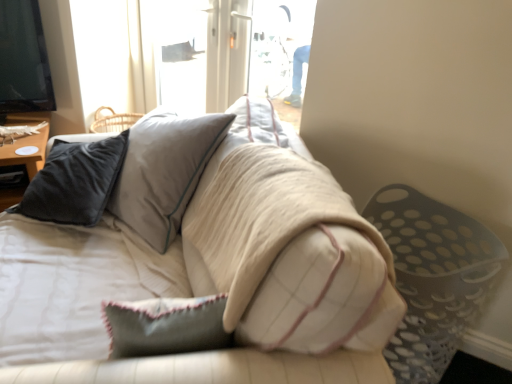
Measure the distance between point (21,115) and camera.

A distance of 2.24 meters exists between point (21,115) and camera.

Where is `matte black pillow at left`? The height and width of the screenshot is (384, 512). matte black pillow at left is located at coordinates (24, 155).

Describe the element at coordinates (24, 155) in the screenshot. Image resolution: width=512 pixels, height=384 pixels. I see `matte black pillow at left` at that location.

What do you see at coordinates (279, 326) in the screenshot? This screenshot has width=512, height=384. I see `soft beige fabric couch at center` at bounding box center [279, 326].

What is the approximate width of soft beige fabric couch at center?

soft beige fabric couch at center is 3.85 feet in width.

The height and width of the screenshot is (384, 512). Find the location of `soft beige fabric couch at center`. soft beige fabric couch at center is located at coordinates (279, 326).

At what (x,y) coordinates should I click in order to perform the action: click on matte black pillow at left. Please return your answer as a coordinate pair (x, y). Looking at the image, I should click on (24, 155).

Visually, is soft beige fabric couch at center positioned to the left or to the right of matte black pillow at left?

soft beige fabric couch at center is to the right of matte black pillow at left.

Which object is further away from the camera taking this photo, soft beige fabric couch at center or matte black pillow at left?

matte black pillow at left is further from the camera.

Which point is more forward, (34, 303) or (18, 143)?

Positioned in front is point (34, 303).

From the image's perspective, relative to matte black pillow at left, is soft beige fabric couch at center above or below?

soft beige fabric couch at center is below matte black pillow at left.

From a real-world perspective, is soft beige fabric couch at center positioned above or below matte black pillow at left?

soft beige fabric couch at center is above matte black pillow at left.

Considering the sizes of objects soft beige fabric couch at center and matte black pillow at left in the image provided, who is thinner, soft beige fabric couch at center or matte black pillow at left?

matte black pillow at left.

Does soft beige fabric couch at center have a lesser height compared to matte black pillow at left?

No.

Between soft beige fabric couch at center and matte black pillow at left, which one has smaller size?

matte black pillow at left.

Is matte black pillow at left a part of soft beige fabric couch at center?

No, matte black pillow at left is not surrounded by soft beige fabric couch at center.

Is soft beige fabric couch at center not close to matte black pillow at left?

soft beige fabric couch at center is actually quite close to matte black pillow at left.

Is soft beige fabric couch at center oriented towards matte black pillow at left?

Answer: No.

Can you tell me how much soft beige fabric couch at center and matte black pillow at left differ in facing direction?

The facing directions of soft beige fabric couch at center and matte black pillow at left are 95.6 degrees apart.

How much distance is there between soft beige fabric couch at center and matte black pillow at left?

A distance of 39.08 inches exists between soft beige fabric couch at center and matte black pillow at left.

Identify the location of table located underneath the soft beige fabric couch at center (from a real-world perspective). (24, 155).

Would you say matte black pillow at left is to the left or to the right of soft beige fabric couch at center in the picture?

matte black pillow at left is to the left of soft beige fabric couch at center.

Between matte black pillow at left and soft beige fabric couch at center, which one is positioned behind?

matte black pillow at left is further away from the camera.

Considering the positions of point (8, 125) and point (123, 375), is point (8, 125) closer or farther from the camera than point (123, 375)?

Clearly, point (8, 125) is more distant from the camera than point (123, 375).

From the image's perspective, relative to soft beige fabric couch at center, is matte black pillow at left above or below?

matte black pillow at left is situated higher than soft beige fabric couch at center in the image.

From a real-world perspective, which object rests below the other?

matte black pillow at left.

Can you confirm if matte black pillow at left is wider than soft beige fabric couch at center?

In fact, matte black pillow at left might be narrower than soft beige fabric couch at center.

Considering the sizes of matte black pillow at left and soft beige fabric couch at center in the image, is matte black pillow at left taller or shorter than soft beige fabric couch at center?

Clearly, matte black pillow at left is shorter compared to soft beige fabric couch at center.

Can you confirm if matte black pillow at left is smaller than soft beige fabric couch at center?

Yes.

Is matte black pillow at left not inside soft beige fabric couch at center?

Indeed, matte black pillow at left is completely outside soft beige fabric couch at center.

Looking at this image, are matte black pillow at left and soft beige fabric couch at center beside each other?

No, matte black pillow at left is not beside soft beige fabric couch at center.

Looking at this image, could you tell me if matte black pillow at left is turned towards soft beige fabric couch at center?

Answer: Yes, matte black pillow at left is oriented towards soft beige fabric couch at center.

In the image, there is a matte black pillow at left. Where is `studio couch below it (from the image's perspective)`? studio couch below it (from the image's perspective) is located at coordinates (279, 326).

You are a GUI agent. You are given a task and a screenshot of the screen. Output one action in this format:
    pyautogui.click(x=<x>, y=<y>)
    Task: Click on the table located underneath the soft beige fabric couch at center (from a real-world perspective)
    The image size is (512, 384).
    Given the screenshot: What is the action you would take?
    pyautogui.click(x=24, y=155)

Locate an element on the screen. This screenshot has height=384, width=512. studio couch below the matte black pillow at left (from the image's perspective) is located at coordinates (279, 326).